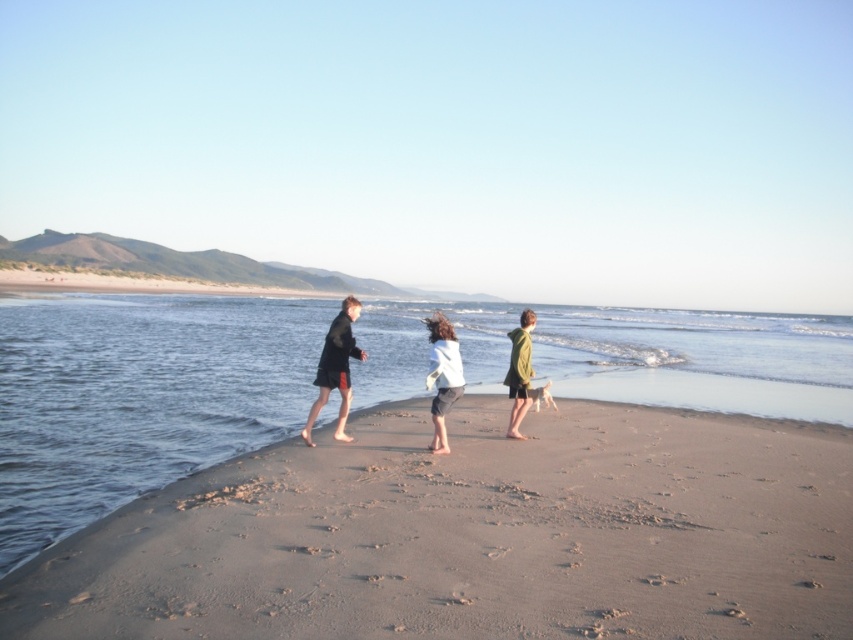
Is point (335, 349) farther from camera compared to point (515, 376)?

No, (335, 349) is in front of (515, 376).

Which is more to the right, dark matte coat at center or green textured hoodie at center?

green textured hoodie at center

What do you see at coordinates (335, 369) in the screenshot? I see `dark matte coat at center` at bounding box center [335, 369].

The image size is (853, 640). Find the location of `dark matte coat at center`. dark matte coat at center is located at coordinates (335, 369).

From the picture: Is white soft sweater at center wider than green textured hoodie at center?

No.

Does white soft sweater at center appear over green textured hoodie at center?

Actually, white soft sweater at center is below green textured hoodie at center.

The width and height of the screenshot is (853, 640). Describe the element at coordinates (442, 376) in the screenshot. I see `white soft sweater at center` at that location.

I want to click on white soft sweater at center, so [442, 376].

Who is positioned more to the right, light brown sand at lower center or white soft sweater at center?

From the viewer's perspective, light brown sand at lower center appears more on the right side.

From the picture: Between light brown sand at lower center and white soft sweater at center, which one has less height?

light brown sand at lower center

The width and height of the screenshot is (853, 640). Identify the location of light brown sand at lower center. (474, 536).